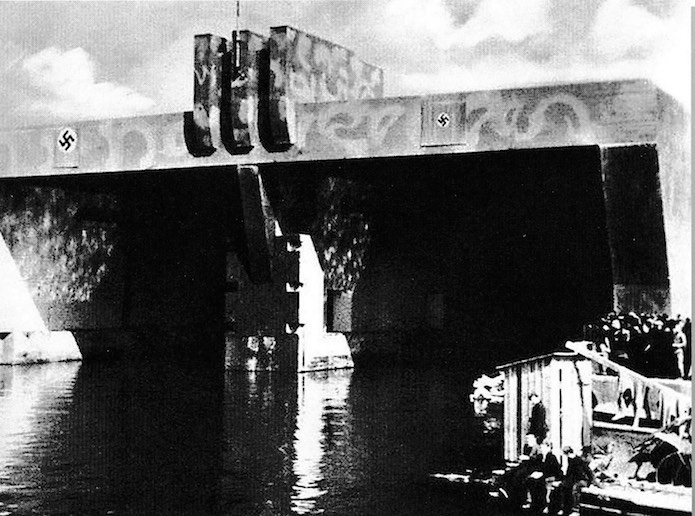
Image resolution: width=695 pixels, height=516 pixels. What are the coordinates of `three large walls` in the screenshot? It's located at (295, 68), (252, 62), (208, 63).